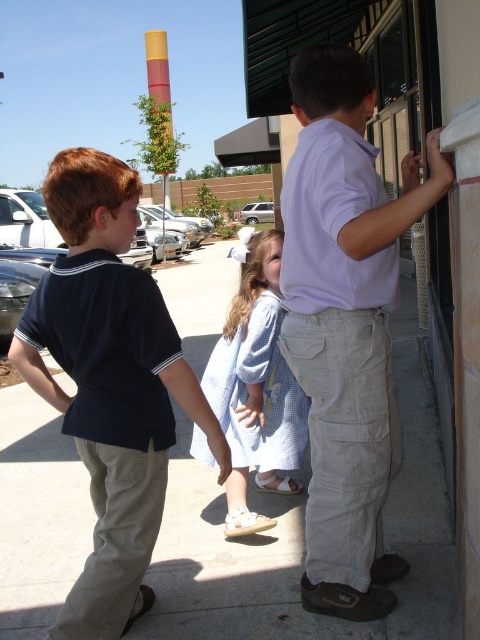
Is dark blue cotton shirt at left wider than light blue cotton dress at center?

Yes.

Is dark blue cotton shirt at left bigger than light blue cotton dress at center?

Yes.

Which is behind, point (142, 577) or point (282, 358)?

The point (282, 358) is more distant.

This screenshot has height=640, width=480. I want to click on dark blue cotton shirt at left, so click(109, 384).

Does light gray concrete pavement at center appear on the left side of light purple shirt at upper right?

Yes, light gray concrete pavement at center is to the left of light purple shirt at upper right.

Which is above, light gray concrete pavement at center or light purple shirt at upper right?

light purple shirt at upper right

Does point (276, 538) come farther from viewer compared to point (396, 278)?

Yes, it is.

Where is `light gray concrete pavement at center`? light gray concrete pavement at center is located at coordinates (301, 540).

Is light gray concrete pavement at center shorter than light blue cotton dress at center?

No.

Is light gray concrete pavement at center taller than light blue cotton dress at center?

Yes, light gray concrete pavement at center is taller than light blue cotton dress at center.

Which is behind, point (299, 506) or point (269, 275)?

Positioned behind is point (299, 506).

Locate an element on the screen. This screenshot has height=640, width=480. light gray concrete pavement at center is located at coordinates (301, 540).